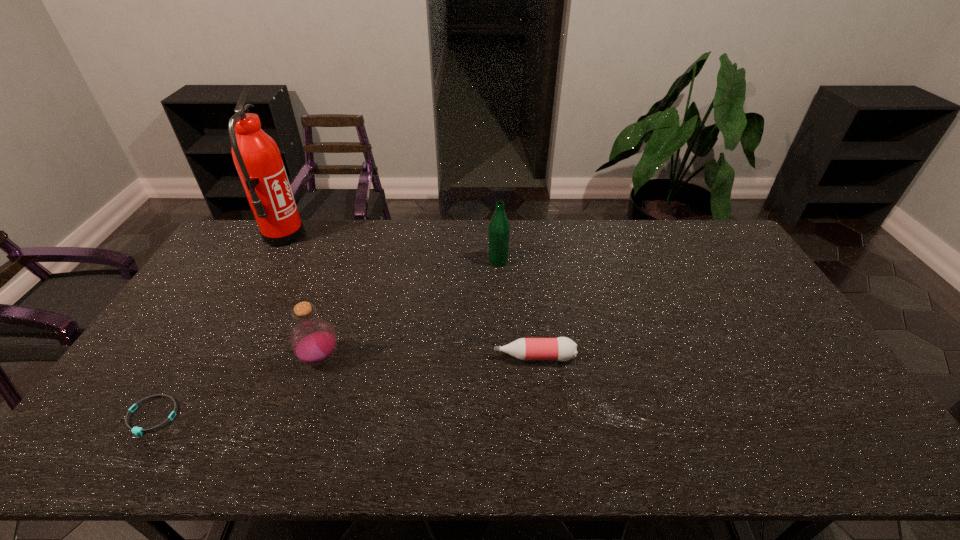
At what (x,y) coordinates should I click in order to perform the action: click on free point located 0.340m on the left of the second farthest object. Please return your answer as a coordinate pair (x, y). The image size is (960, 540). Looking at the image, I should click on (391, 261).

What are the coordinates of `vacant space located 0.070m on the left of the second tallest bottle` in the screenshot? It's located at 275,359.

Locate an element on the screen. The image size is (960, 540). free spot located 0.160m with the cap open on the second shortest object is located at coordinates [436, 357].

In order to click on blank space located 0.100m with the cap open on the second shortest object in this screenshot , I will do `click(458, 357)`.

At what (x,y) coordinates should I click in order to perform the action: click on free location located 0.050m with the cap open on the second shortest object. Please return your answer as a coordinate pair (x, y). Looking at the image, I should click on (475, 357).

The width and height of the screenshot is (960, 540). Identify the location of fire extinguisher at the far edge. (257, 158).

I want to click on bottle that is at the far edge, so click(x=499, y=228).

In order to click on object located in the near edge section of the desktop in this screenshot , I will do `click(135, 430)`.

Where is `fire extinguisher situated at the left edge`? fire extinguisher situated at the left edge is located at coordinates (257, 158).

Find the location of a particular element. This screenshot has height=540, width=960. wristband at the left edge is located at coordinates (135, 430).